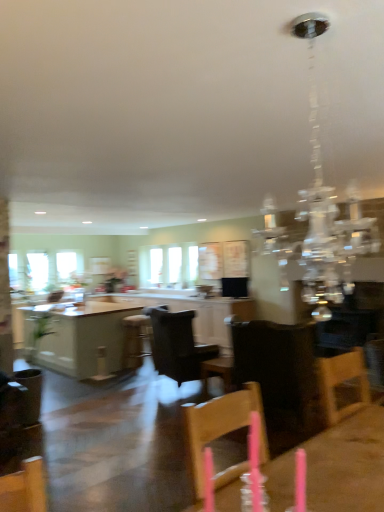
Question: Is black leather chair at center, the first chair in the left-to-right sequence, taller than white glossy table at center, marked as the 1th table in a back-to-front arrangement?

Choices:
 (A) yes
 (B) no

Answer: (A)

Question: From a real-world perspective, is black leather chair at center, the 2th chair positioned from the right, located beneath white glossy table at center, marked as the 1th table in a back-to-front arrangement?

Choices:
 (A) no
 (B) yes

Answer: (A)

Question: Would you say black leather chair at center, the first chair in the left-to-right sequence, is a long distance from white glossy table at center, marked as the 1th table in a left-to-right arrangement?

Choices:
 (A) yes
 (B) no

Answer: (B)

Question: Is black leather chair at center, positioned as the 1th chair in back-to-front order, smaller than white glossy table at center, which appears as the first table when ordered from the bottom?

Choices:
 (A) no
 (B) yes

Answer: (B)

Question: Can we say black leather chair at center, the 2th chair positioned from the front, lies outside white glossy table at center, marked as the 1th table in a left-to-right arrangement?

Choices:
 (A) no
 (B) yes

Answer: (B)

Question: From a real-world perspective, is clear glass window at left, marked as the second window in a right-to-left arrangement, positioned above or below black leather chair at center, the 2th chair positioned from the front?

Choices:
 (A) below
 (B) above

Answer: (B)

Question: Considering their positions, is clear glass window at left, positioned as the 1th window in left-to-right order, located in front of or behind black leather chair at center, the 2th chair positioned from the right?

Choices:
 (A) front
 (B) behind

Answer: (B)

Question: Looking at the image, does clear glass window at left, positioned as the 1th window in left-to-right order, seem bigger or smaller compared to black leather chair at center, the first chair in the left-to-right sequence?

Choices:
 (A) small
 (B) big

Answer: (A)

Question: Which is correct: clear glass window at left, positioned as the 1th window in left-to-right order, is inside black leather chair at center, the first chair in the left-to-right sequence, or outside of it?

Choices:
 (A) outside
 (B) inside

Answer: (A)

Question: From a real-world perspective, is dark brown leather chair at center, which is the first chair in front-to-back order, positioned above or below clear crystal chandelier at upper center?

Choices:
 (A) above
 (B) below

Answer: (B)

Question: Is dark brown leather chair at center, which is counted as the first chair, starting from the right, taller or shorter than clear crystal chandelier at upper center?

Choices:
 (A) tall
 (B) short

Answer: (A)

Question: Considering the positions of point (296, 398) and point (273, 312), is point (296, 398) closer or farther from the camera than point (273, 312)?

Choices:
 (A) farther
 (B) closer

Answer: (B)

Question: Is dark brown leather chair at center, the second chair viewed from the left, inside the boundaries of clear crystal chandelier at upper center, or outside?

Choices:
 (A) outside
 (B) inside

Answer: (A)

Question: Is point (372, 428) closer or farther from the camera than point (130, 347)?

Choices:
 (A) closer
 (B) farther

Answer: (A)

Question: From a real-world perspective, relative to wooden bar stool at center, is wooden table at center, the second table when ordered from left to right, vertically above or below?

Choices:
 (A) below
 (B) above

Answer: (B)